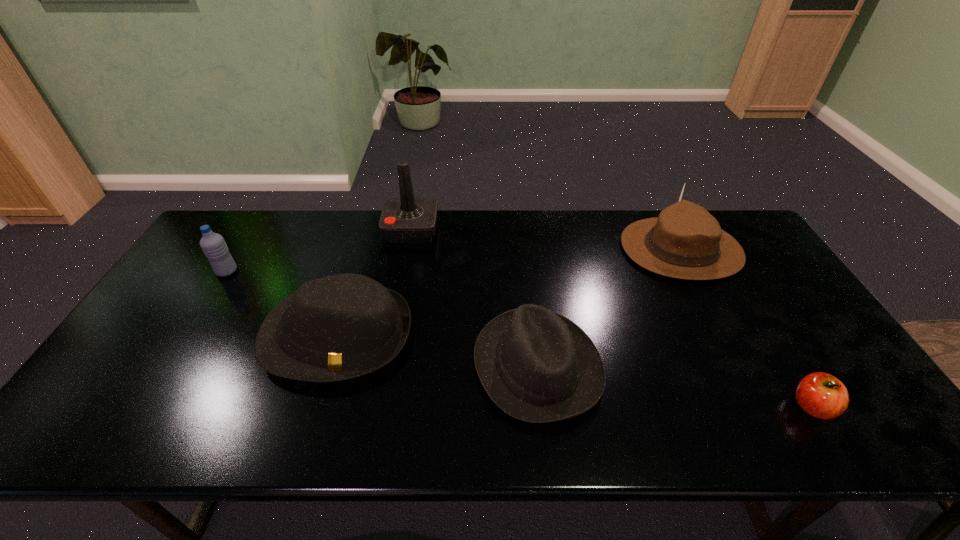
The image size is (960, 540). I want to click on vacant space at the near right corner of the desktop, so click(876, 444).

The image size is (960, 540). What are the coordinates of `vacant area that lies between the third object from right to left and the leftmost fedora` in the screenshot? It's located at (438, 350).

The width and height of the screenshot is (960, 540). Find the location of `free point between the rightmost fedora and the leftmost fedora`. free point between the rightmost fedora and the leftmost fedora is located at coordinates (510, 292).

The image size is (960, 540). I want to click on vacant area that lies between the rightmost fedora and the tallest object, so click(x=546, y=239).

At what (x,y) coordinates should I click in order to perform the action: click on vacant area that lies between the fourth object from left to right and the tallest object. Please return your answer as a coordinate pair (x, y). The width and height of the screenshot is (960, 540). Looking at the image, I should click on (474, 298).

This screenshot has height=540, width=960. Identify the location of free space between the leftmost fedora and the rightmost fedora. (510, 292).

You are a GUI agent. You are given a task and a screenshot of the screen. Output one action in this format:
    pyautogui.click(x=<x>, y=<y>)
    Task: Click on the blank region between the fifth tallest object and the tallest object
    
    Given the screenshot: What is the action you would take?
    [474, 298]

The image size is (960, 540). What are the coordinates of `vacant region between the joystick and the shortest object` in the screenshot? It's located at (612, 318).

What are the coordinates of `free space between the leftmost fedora and the fifth tallest object` in the screenshot? It's located at (438, 350).

Where is `free spot between the second shortest object and the farthest fedora`? This screenshot has height=540, width=960. free spot between the second shortest object and the farthest fedora is located at coordinates pyautogui.click(x=609, y=307).